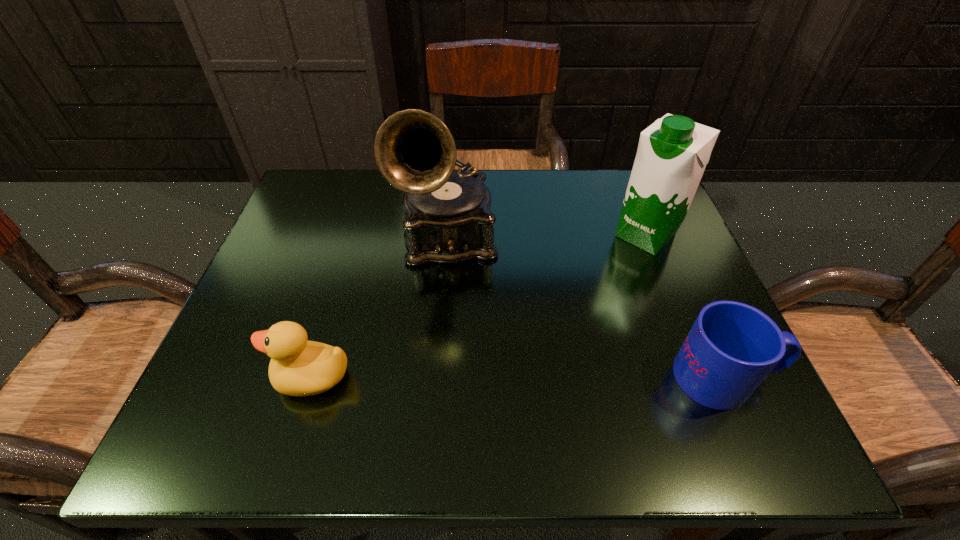
This screenshot has width=960, height=540. Find the location of `vacant spot on the desktop that is between the duck and the mug and is positioned on the horn of the phonograph record`. vacant spot on the desktop that is between the duck and the mug and is positioned on the horn of the phonograph record is located at coordinates (465, 377).

Find the location of `free spot on the desktop that is between the duck and the mug and is positioned on the front-facing side of the second tallest object`. free spot on the desktop that is between the duck and the mug and is positioned on the front-facing side of the second tallest object is located at coordinates (502, 377).